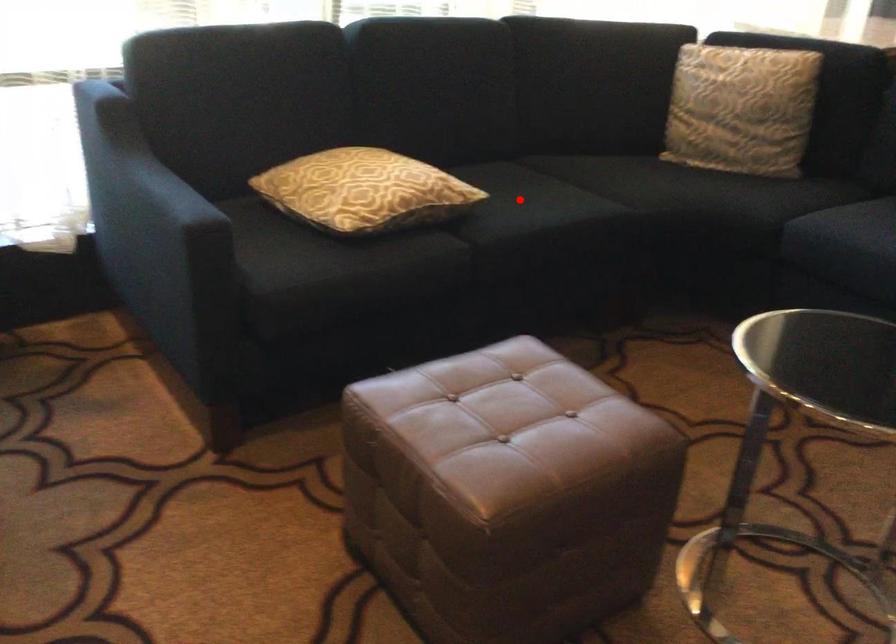
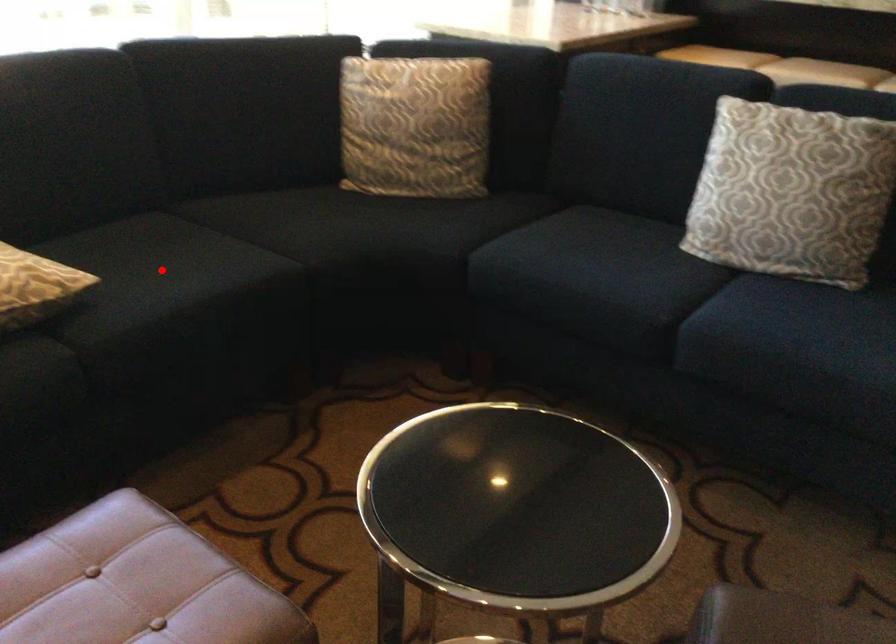
I am providing you with two images of the same scene from different viewpoints. A red point is marked on the first image and another point is marked on the second image. Are the points marked in image1 and image2 representing the same 3D position?

Yes